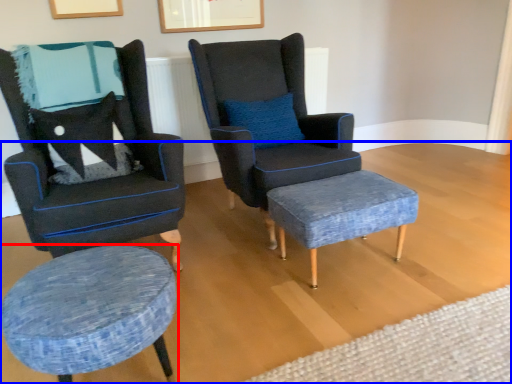
Question: Among these objects, which one is nearest to the camera, stool (highlighted by a red box) or plain (highlighted by a blue box)?

Choices:
 (A) stool
 (B) plain

Answer: (B)